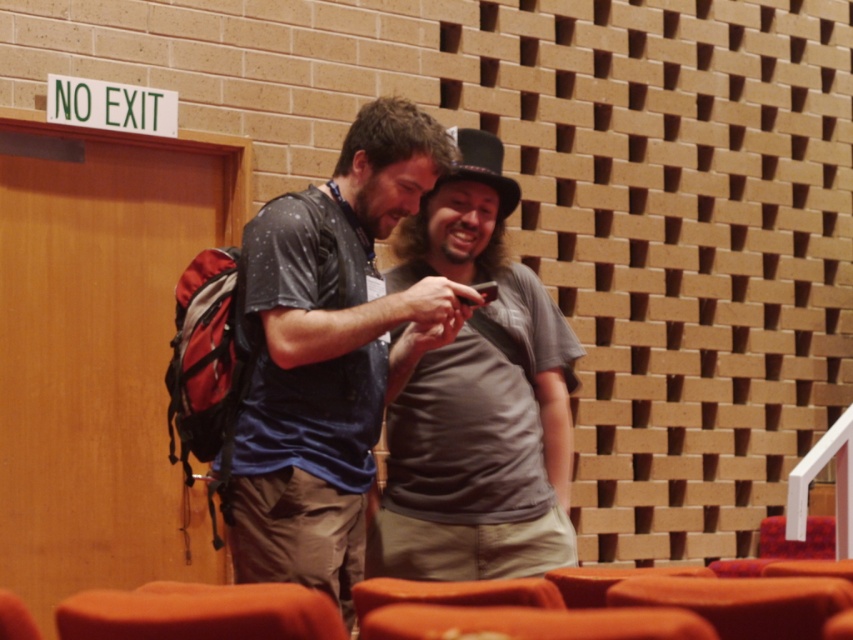
You are a delivery person who needs to place a small package on the gray cotton shirt at center and the orange fabric chair at lower left. Which object is higher up in the image?

The gray cotton shirt at center is above the orange fabric chair at lower left, so you should place the package on the gray cotton shirt at center since it is higher up.

What are the coordinates of the matte blue shirt at center?

The matte blue shirt at center is located at point (329,353).

You are trying to decide which shirt to wear for a casual day out. Both the matte blue shirt at center and the gray cotton shirt at center are options. Based on their sizes, which one might you choose if you prefer a looser fit?

The matte blue shirt at center might be wider than the gray cotton shirt at center, so if you prefer a looser fit, you should choose the matte blue shirt at center.